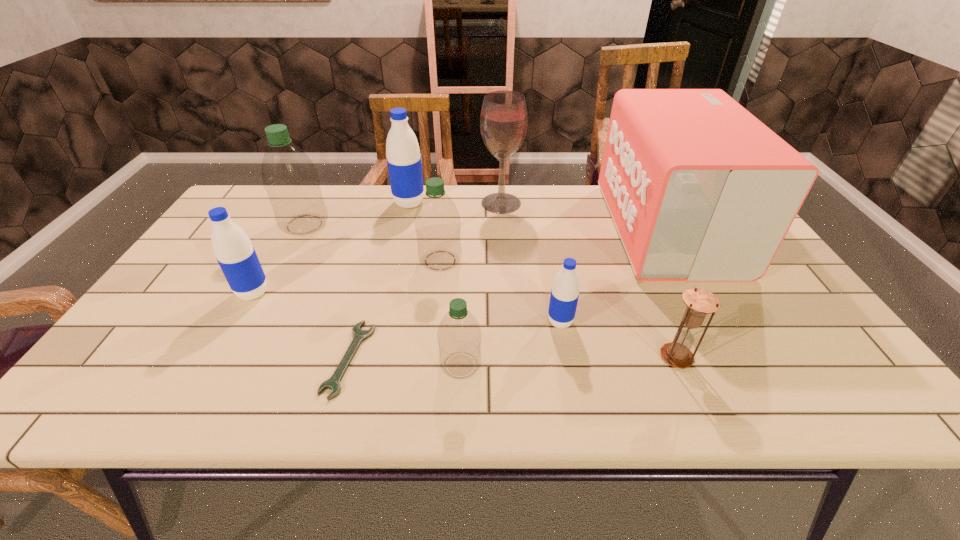
Find the location of a particular element. The height and width of the screenshot is (540, 960). the eighth object from left to right is located at coordinates (564, 296).

This screenshot has width=960, height=540. I want to click on the rightmost blue water bottle, so click(x=564, y=296).

Find the location of `the nearest green water bottle`. the nearest green water bottle is located at coordinates (459, 336).

The image size is (960, 540). Find the location of `the nearest water bottle`. the nearest water bottle is located at coordinates (459, 336).

The width and height of the screenshot is (960, 540). What are the coordinates of `hourglass` in the screenshot? It's located at (700, 302).

In order to click on wrench in this screenshot , I will do tap(333, 383).

Locate an element on the screen. The image size is (960, 540). free space located 0.230m on the right of the alcohol is located at coordinates (594, 203).

The width and height of the screenshot is (960, 540). Identify the location of free region located on the surface of the box where the text is embossed. (580, 228).

You are a GUI agent. You are given a task and a screenshot of the screen. Output one action in this format:
    pyautogui.click(x=<x>, y=<y>)
    Task: Click on the free space located on the surface of the box where the text is embossed
    The image size is (960, 540).
    Given the screenshot: What is the action you would take?
    pyautogui.click(x=510, y=228)

You are a GUI agent. You are given a task and a screenshot of the screen. Output one action in this format:
    pyautogui.click(x=<x>, y=<y>)
    Task: Click on the free space located 0.260m on the surface of the box where the text is embossed
    Image resolution: width=960 pixels, height=540 pixels.
    Given the screenshot: What is the action you would take?
    pyautogui.click(x=523, y=228)